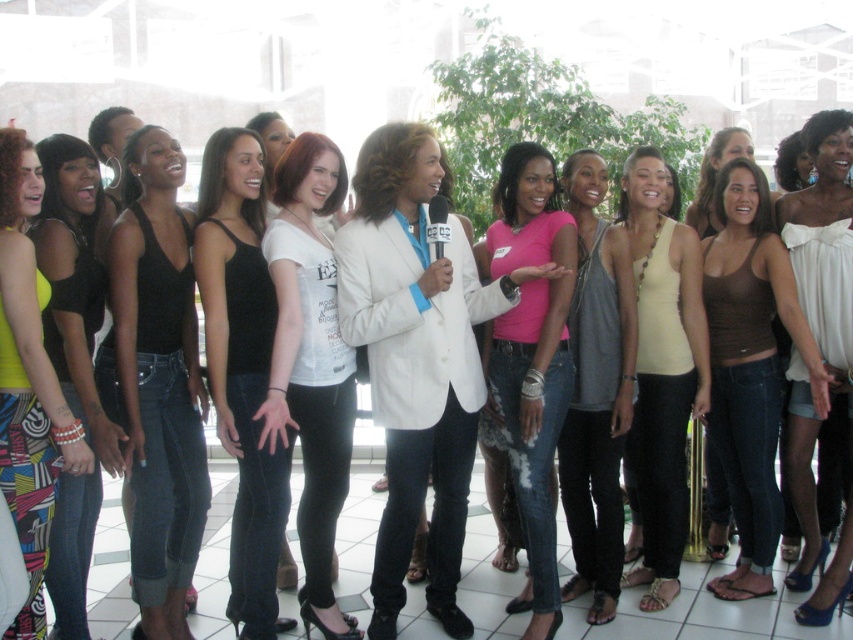
You are a photographer adjusting your camera settings to capture the group of women in the scene. You notice two points marked in the image. Which point is closer to the camera, point (364, 243) or point (36, 547)?

Point (364, 243) is closer to the camera than point (36, 547) because it is further to the viewer.